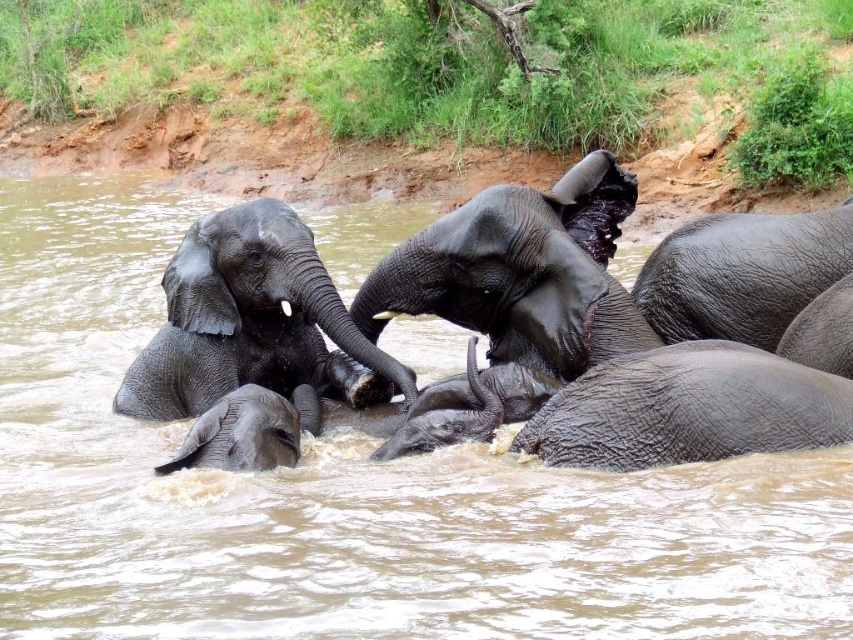
Question: Among these objects, which one is farthest from the camera?

Choices:
 (A) dark gray wrinkled elephant at center
 (B) shiny gray elephant at center
 (C) wet gray elephant at lower right

Answer: (B)

Question: Can you confirm if brown muddy water at center is thinner than gray textured baby elephant at lower left?

Choices:
 (A) no
 (B) yes

Answer: (A)

Question: Considering the real-world distances, which object is farthest from the gray textured baby elephant at lower left?

Choices:
 (A) shiny dark gray elephant at center
 (B) dark gray textured elephant at center

Answer: (B)

Question: Estimate the real-world distances between objects in this image. Which object is farther from the wet gray elephant at lower right?

Choices:
 (A) brown muddy water at center
 (B) dark gray wrinkled elephant at center

Answer: (A)

Question: From the image, what is the correct spatial relationship of shiny gray elephant at center in relation to dark gray wrinkled elephant at center?

Choices:
 (A) left
 (B) right

Answer: (A)

Question: Does gray textured baby elephant at lower left appear on the left side of dark gray textured elephant at center?

Choices:
 (A) no
 (B) yes

Answer: (B)